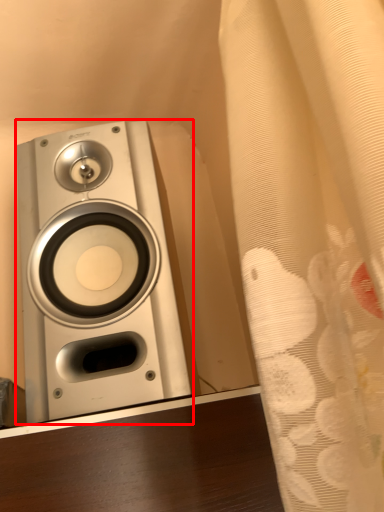
Question: From the image's perspective, where is home appliance (annotated by the red box) located in relation to curtain in the image?

Choices:
 (A) below
 (B) above

Answer: (A)